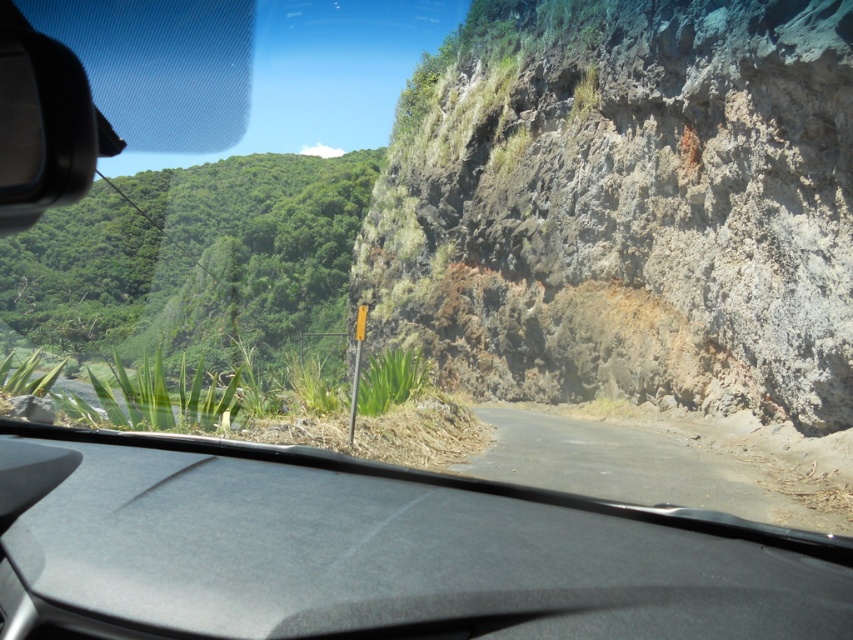
Does rusty rock cliff at right appear on the left side of black matte dashboard at center?

No, rusty rock cliff at right is not to the left of black matte dashboard at center.

Who is higher up, rusty rock cliff at right or black matte dashboard at center?

rusty rock cliff at right is above.

What do you see at coordinates (625, 205) in the screenshot?
I see `rusty rock cliff at right` at bounding box center [625, 205].

At what (x,y) coordinates should I click in order to perform the action: click on rusty rock cliff at right. Please return your answer as a coordinate pair (x, y). The height and width of the screenshot is (640, 853). Looking at the image, I should click on (625, 205).

Is black matte dashboard at center smaller than dirt road at lower right?

Yes, black matte dashboard at center is smaller than dirt road at lower right.

Can you confirm if black matte dashboard at center is bigger than dirt road at lower right?

No.

Between point (589, 529) and point (761, 490), which one is positioned behind?

The point (761, 490) is more distant.

Find the location of `black matte dashboard at center`. black matte dashboard at center is located at coordinates (374, 552).

Is rusty rock cliff at right above dirt road at lower right?

Indeed, rusty rock cliff at right is positioned over dirt road at lower right.

Is rusty rock cliff at right to the left of dirt road at lower right from the viewer's perspective?

Indeed, rusty rock cliff at right is positioned on the left side of dirt road at lower right.

Which is in front, point (576, 106) or point (634, 419)?

Positioned in front is point (634, 419).

Where is `rusty rock cliff at right`? rusty rock cliff at right is located at coordinates (625, 205).